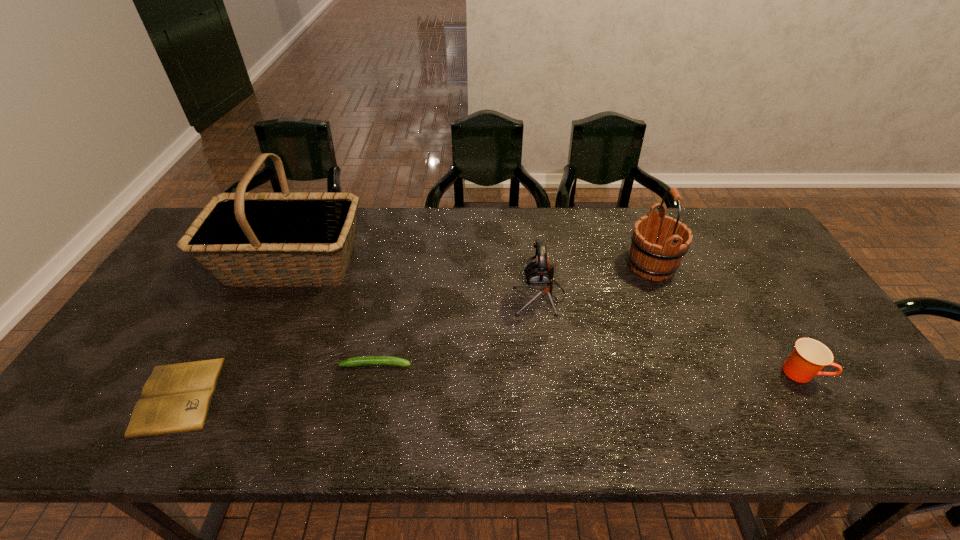
Image resolution: width=960 pixels, height=540 pixels. Identify the location of object that ranks as the second closest to the zucchini. point(176,398).

The height and width of the screenshot is (540, 960). What are the coordinates of `free space in the image that satisfies the following two spatial constraints: 1. by the handle of the tallest object; 2. on the right side of the third tallest object` in the screenshot? It's located at (276, 296).

Find the location of a particular element. The height and width of the screenshot is (540, 960). free location that satisfies the following two spatial constraints: 1. by the handle of the third object from right to left; 2. on the right side of the basket is located at coordinates (276, 296).

At what (x,y) coordinates should I click in order to perform the action: click on vacant space that satisfies the following two spatial constraints: 1. by the handle of the basket; 2. on the back side of the third object from right to left. Please return your answer as a coordinate pair (x, y). The image size is (960, 540). Looking at the image, I should click on (276, 296).

You are a GUI agent. You are given a task and a screenshot of the screen. Output one action in this format:
    pyautogui.click(x=<x>, y=<y>)
    Task: Click on the free space that satisfies the following two spatial constraints: 1. on the front-facing side of the third shortest object; 2. on the right side of the fourth object from right to left
    Image resolution: width=960 pixels, height=540 pixels.
    Given the screenshot: What is the action you would take?
    pyautogui.click(x=374, y=372)

The image size is (960, 540). I want to click on vacant space that satisfies the following two spatial constraints: 1. on the back side of the cup; 2. on the front-facing side of the fourth object from right to left, so coord(796,364).